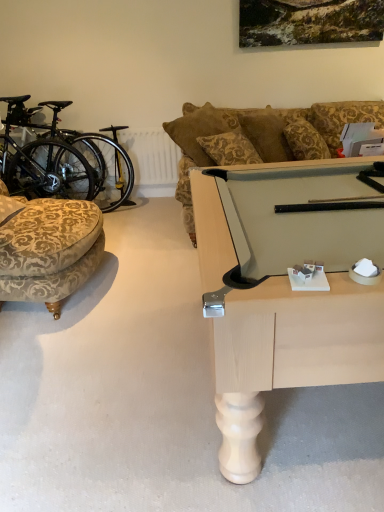
Question: From a real-world perspective, relative to velvet-patterned ottoman at left, is black matte bicycle at left vertically above or below?

Choices:
 (A) below
 (B) above

Answer: (B)

Question: Considering the positions of black matte bicycle at left and velvet-patterned ottoman at left in the image, is black matte bicycle at left wider or thinner than velvet-patterned ottoman at left?

Choices:
 (A) wide
 (B) thin

Answer: (B)

Question: From their relative heights in the image, would you say black matte bicycle at left is taller or shorter than velvet-patterned ottoman at left?

Choices:
 (A) tall
 (B) short

Answer: (A)

Question: Based on their positions, is velvet-patterned ottoman at left located to the left or right of black matte bicycle at left?

Choices:
 (A) right
 (B) left

Answer: (A)

Question: In the image, is velvet-patterned ottoman at left positioned in front of or behind black matte bicycle at left?

Choices:
 (A) front
 (B) behind

Answer: (A)

Question: From their relative heights in the image, would you say velvet-patterned ottoman at left is taller or shorter than black matte bicycle at left?

Choices:
 (A) short
 (B) tall

Answer: (A)

Question: Considering the positions of velvet-patterned ottoman at left and black matte bicycle at left in the image, is velvet-patterned ottoman at left bigger or smaller than black matte bicycle at left?

Choices:
 (A) big
 (B) small

Answer: (B)